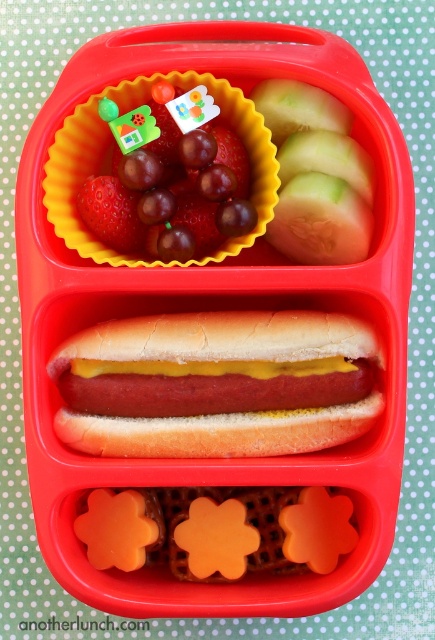
You are a child looking at the bento box and want to eat the shiny red grapes at upper left first. Which direction should you move your hand to reach them from the yellow mustard hot dog at center?

The yellow mustard hot dog at center is positioned on the right side of shiny red grapes at upper left, so you should move your hand to the left to reach the shiny red grapes at upper left.

You are a parent preparing lunch for your child. You want to ensure that the yellow mustard hot dog at center and the shiny red grapes at upper left are visible to the child when they open the bento box. Considering their heights, which food item will appear taller to the child when looking into the bento box?

The shiny red grapes at upper left will appear taller than the yellow mustard hot dog at center because the grapes are taller according to the description.